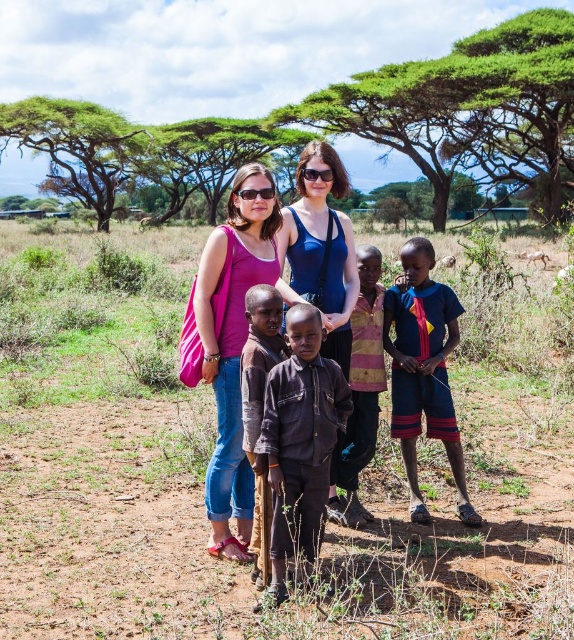
Question: Can you confirm if pink fabric at center is positioned below blue fabric tank top at center?

Choices:
 (A) yes
 (B) no

Answer: (A)

Question: Is green leafy tree at upper center to the right of pink fabric at center from the viewer's perspective?

Choices:
 (A) no
 (B) yes

Answer: (A)

Question: Which of the following is the farthest from the observer?

Choices:
 (A) (420, 266)
 (B) (297, 396)
 (C) (367, 401)

Answer: (C)

Question: From the image, what is the correct spatial relationship of blue cotton shorts at lower right in relation to green leafy tree at upper left?

Choices:
 (A) above
 (B) below

Answer: (B)

Question: Which point is farther to the camera?

Choices:
 (A) (191, 29)
 (B) (424, 406)

Answer: (A)

Question: Which is nearer to the pink fabric bag at center?

Choices:
 (A) striped fabric shirt at center
 (B) brown cotton shirt at center
 (C) blue fabric tank top at center
 (D) dark brown leather jacket at center

Answer: (A)